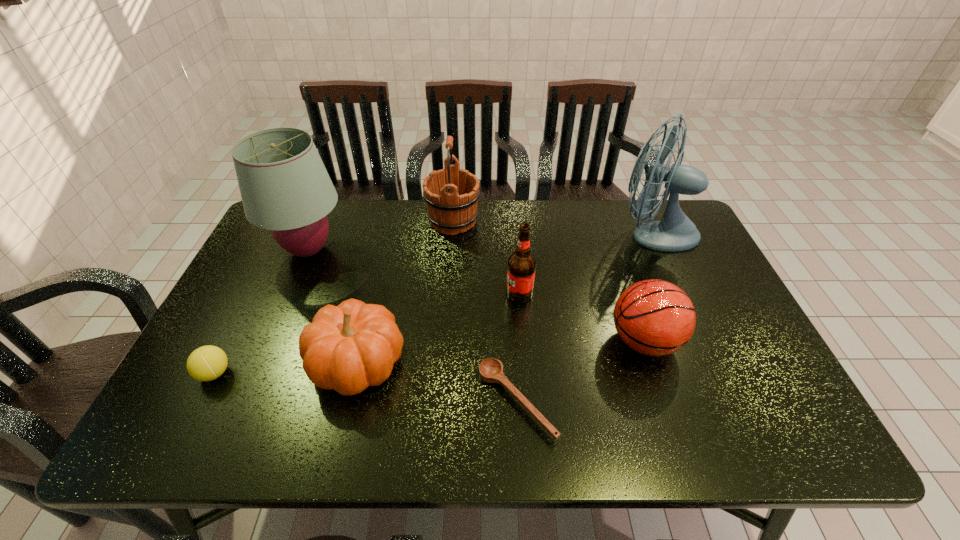
The width and height of the screenshot is (960, 540). In order to click on vacant space positioned in front of the fan to blow air in this screenshot , I will do `click(555, 233)`.

Locate an element on the screen. Image resolution: width=960 pixels, height=540 pixels. vacant region located in front of the fan to blow air is located at coordinates (591, 233).

Locate an element on the screen. The height and width of the screenshot is (540, 960). free space located on the back of the lampshade is located at coordinates (328, 204).

The image size is (960, 540). Find the location of `free space located on the right of the wine bucket`. free space located on the right of the wine bucket is located at coordinates pyautogui.click(x=573, y=221).

Locate an element on the screen. The image size is (960, 540). free space located 0.260m on the front of the root beer is located at coordinates (527, 387).

I want to click on free space located 0.100m on the side with spill of the basketball, so click(x=568, y=341).

I want to click on vacant space located 0.300m on the side with spill of the basketball, so click(x=489, y=341).

Find the location of a particular element. Image resolution: width=960 pixels, height=540 pixels. vacant space located 0.100m on the side with spill of the basketball is located at coordinates tap(568, 341).

Where is `free space located 0.070m on the front of the pumpkin`? The image size is (960, 540). free space located 0.070m on the front of the pumpkin is located at coordinates (340, 435).

The width and height of the screenshot is (960, 540). I want to click on free region located 0.160m on the back of the tennis ball, so (247, 310).